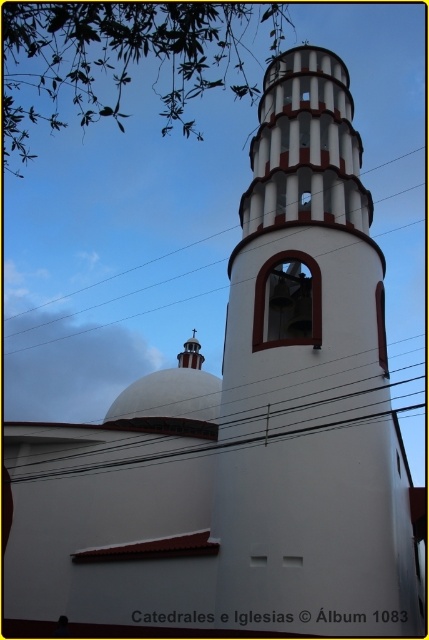
Question: Can you confirm if white smooth dome at center is bigger than white matte dome at center?

Choices:
 (A) yes
 (B) no

Answer: (A)

Question: Which point is closer to the camera?

Choices:
 (A) white smooth dome at center
 (B) white smooth bell tower at center
 (C) black wire at upper center

Answer: (B)

Question: Can you confirm if white smooth bell tower at center is bigger than white smooth dome at center?

Choices:
 (A) yes
 (B) no

Answer: (A)

Question: Among these objects, which one is nearest to the camera?

Choices:
 (A) black wire at upper center
 (B) white smooth dome at center
 (C) white matte dome at center

Answer: (B)

Question: Where is white smooth bell tower at center located in relation to white matte dome at center in the image?

Choices:
 (A) right
 (B) left

Answer: (A)

Question: Estimate the real-world distances between objects in this image. Which object is farther from the white matte dome at center?

Choices:
 (A) white smooth bell tower at center
 (B) white smooth dome at center

Answer: (A)